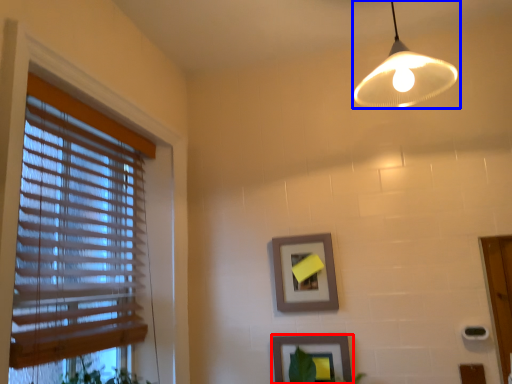
Question: Which of the following is the farthest to the observer, picture frame (highlighted by a red box) or lamp (highlighted by a blue box)?

Choices:
 (A) picture frame
 (B) lamp

Answer: (A)